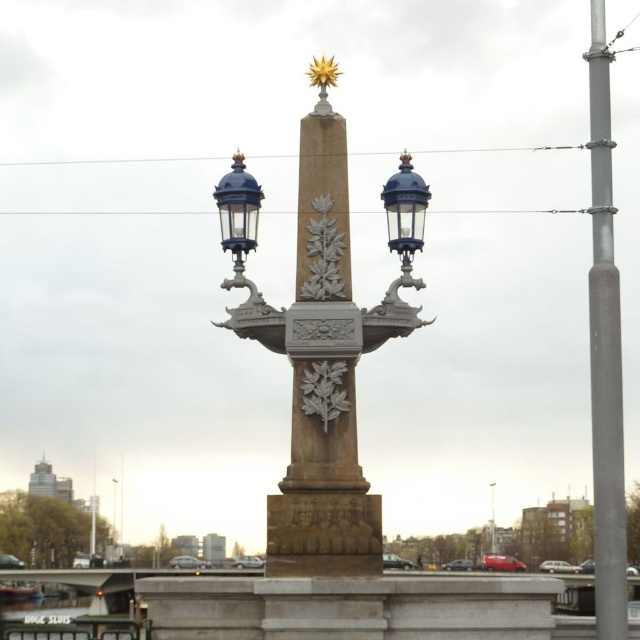
You are a drone operator planning to fly a drone from your current position to the silver metallic pole at right. Given that the drone has a maximum flight range of 500 feet, will it be able to reach the pole without needing a recharge?

The silver metallic pole at right is 528.86 feet away from the camera. Since the drone can only fly up to 500 feet before needing a recharge, it will not be able to reach the pole without recharging.

Based on the scene description, where is the stone obelisk at center located in terms of its 2D coordinates?

The stone obelisk at center is located at the 2D coordinates of point (323,342).

You are standing at a point 156.67 meters away from the monument. If you walk directly towards the monument, will you pass through the point labeled as point [355,342]?

Yes, because the point [355,342] is exactly 156.67 meters away from the viewer, so walking directly towards the monument would pass through that point.